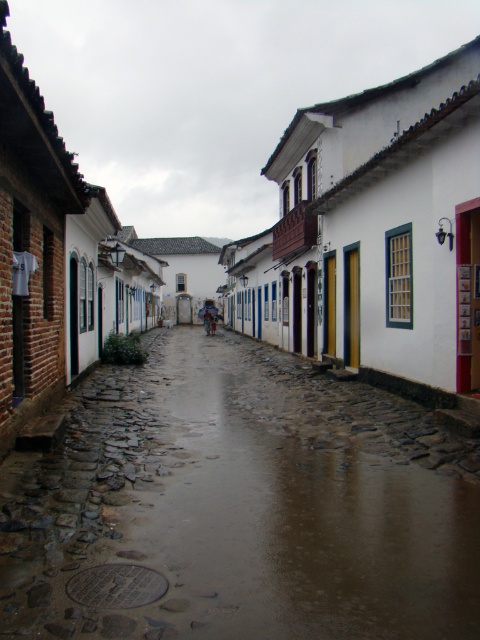
Question: Does wet cobblestone alley at center come behind smooth cobblestone street at center?

Choices:
 (A) no
 (B) yes

Answer: (A)

Question: Which of the following is the closest to the observer?

Choices:
 (A) wet cobblestone alley at center
 (B) smooth cobblestone street at center

Answer: (A)

Question: Which point is farther to the camera?

Choices:
 (A) smooth cobblestone street at center
 (B) wet cobblestone alley at center

Answer: (A)

Question: Does wet cobblestone alley at center lie behind smooth cobblestone street at center?

Choices:
 (A) no
 (B) yes

Answer: (A)

Question: Is wet cobblestone alley at center above smooth cobblestone street at center?

Choices:
 (A) no
 (B) yes

Answer: (A)

Question: Among these points, which one is farthest from the camera?

Choices:
 (A) (362, 369)
 (B) (317, 534)

Answer: (A)